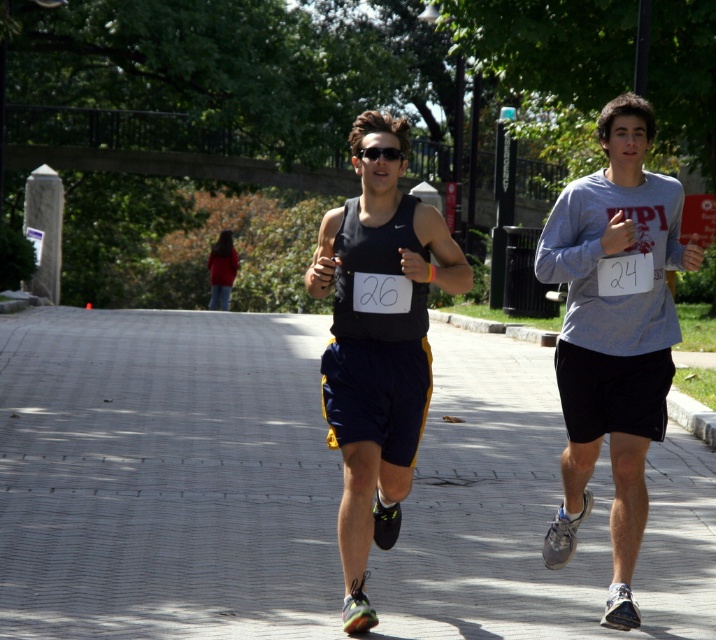
You are a photographer positioned behind the runners. You want to capture a photo where the gray brick pavement at center is clearly visible behind the gray cotton shirt at right. Is this possible given their current positions?

The gray brick pavement at center is in front of the gray cotton shirt at right, so it would block the view of the pavement behind it. Therefore, you cannot capture the gray brick pavement at center clearly behind the gray cotton shirt at right in this position.

You are a runner in a race and need to decide whether to pass the gray cotton shirt at right by moving to the left. Is the gray brick pavement at center available for you to move there?

The gray brick pavement at center is to the left of the gray cotton shirt at right, so yes, you can move to the gray brick pavement at center to pass the gray cotton shirt at right.

You are a photographer positioned behind the runners. You want to capture a photo where both the gray cotton shirt at right and the matte black tank top at center are visible. Considering their heights, which runner should be placed closer to the camera to ensure both are fully visible in the frame?

The gray cotton shirt at right is taller than the matte black tank top at center. To ensure both are fully visible, position the shorter matte black tank top at center closer to the camera so it appears larger in the frame, balancing their sizes.